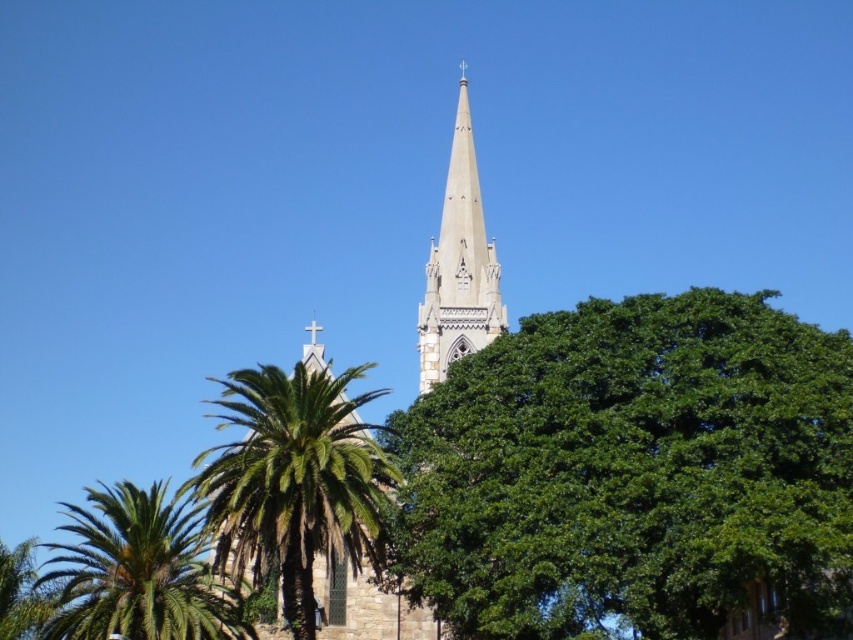
Question: Which object is farther from the camera taking this photo?

Choices:
 (A) white stone church steeple at center
 (B) green leafy tree at center
 (C) smooth stone spire at center
 (D) green leafy palm tree at left

Answer: (C)

Question: Among these points, which one is nearest to the camera?

Choices:
 (A) (663, 419)
 (B) (437, 376)
 (C) (80, 554)

Answer: (A)

Question: Is green leafy palm tree at lower left thinner than smooth stone spire at center?

Choices:
 (A) yes
 (B) no

Answer: (B)

Question: Can you confirm if green leafy tree at center is positioned to the right of smooth stone spire at center?

Choices:
 (A) no
 (B) yes

Answer: (B)

Question: Can you confirm if green leafy tree at center is bigger than green leafy palm tree at left?

Choices:
 (A) yes
 (B) no

Answer: (B)

Question: Which object is the farthest from the white stone church steeple at center?

Choices:
 (A) green leafy palm tree at lower left
 (B) smooth stone spire at center
 (C) green leafy tree at center

Answer: (C)